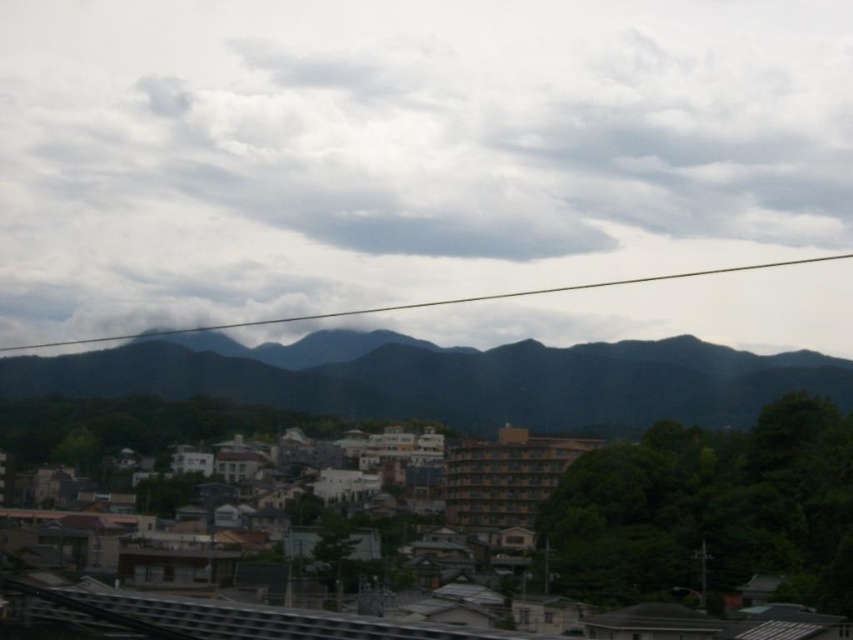
You are standing in a town nestled at the foot of a mountain range. You see a point at coordinates (403, 150). What is located at this point?

The cloudy sky at upper center is located at point (403, 150).

You are an urban planner reviewing the town layout. You notice the dark green textured mountains at center and the transparent wire at upper center. Which object appears smaller in the image?

The dark green textured mountains at center appears smaller compared to the transparent wire at upper center.